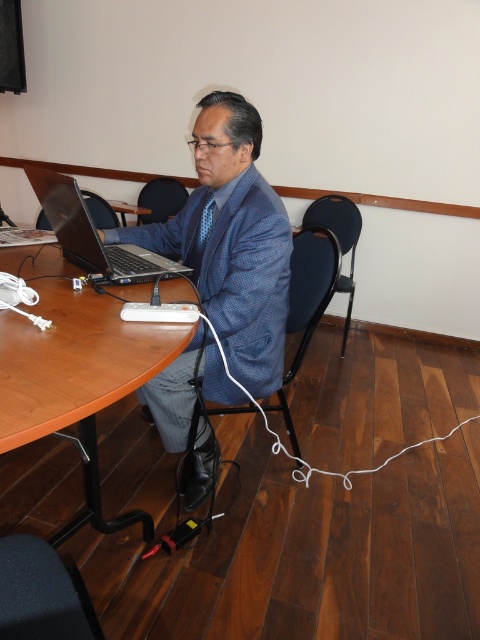
Question: Considering the relative positions of blue textured suit at center and matte black laptop at center in the image provided, where is blue textured suit at center located with respect to matte black laptop at center?

Choices:
 (A) left
 (B) right

Answer: (B)

Question: Which point is closer to the camera?

Choices:
 (A) (80, 259)
 (B) (206, 333)
 (C) (148, 378)

Answer: (C)

Question: Which point is farther to the camera?

Choices:
 (A) brown wooden table at center
 (B) matte black laptop at center
 (C) blue textured suit at center

Answer: (C)

Question: Which point is farther to the camera?

Choices:
 (A) blue textured suit at center
 (B) brown wooden table at center
 (C) matte black laptop at center

Answer: (A)

Question: From the image, what is the correct spatial relationship of blue textured suit at center in relation to brown wooden table at center?

Choices:
 (A) below
 (B) above

Answer: (A)

Question: Is blue textured suit at center bigger than matte black laptop at center?

Choices:
 (A) no
 (B) yes

Answer: (B)